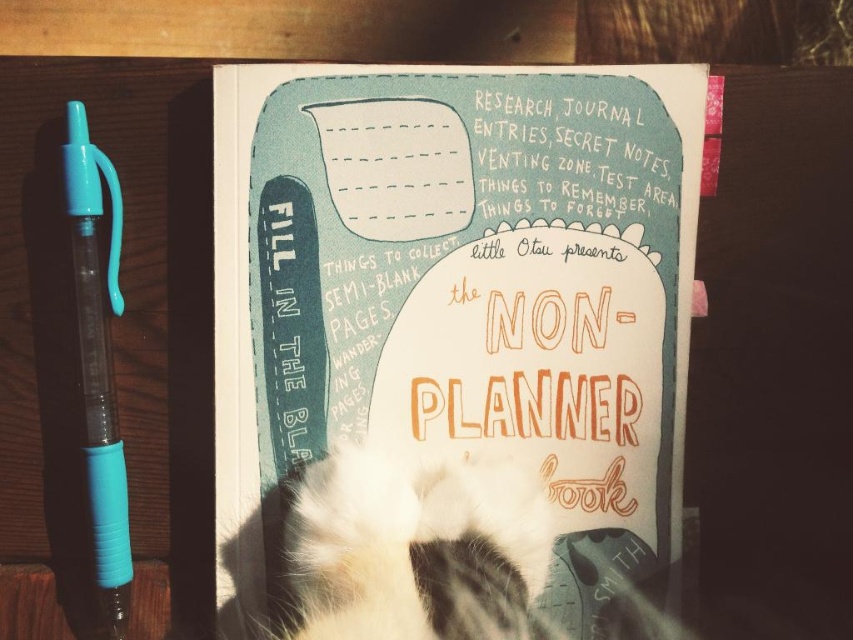
Question: Estimate the real-world distances between objects in this image. Which object is farther from the translucent blue plastic pen at left?

Choices:
 (A) fluffy white fur at center
 (B) matte paper journal at center

Answer: (B)

Question: Can you confirm if matte paper journal at center is positioned to the left of translucent blue plastic pen at left?

Choices:
 (A) yes
 (B) no

Answer: (B)

Question: Which point is farther from the camera taking this photo?

Choices:
 (A) (297, 384)
 (B) (100, 186)

Answer: (A)

Question: Which of the following is the closest to the observer?

Choices:
 (A) matte paper journal at center
 (B) translucent blue plastic pen at left

Answer: (B)

Question: Does fluffy white fur at center appear on the left side of translucent blue plastic pen at left?

Choices:
 (A) yes
 (B) no

Answer: (B)

Question: Can you confirm if matte paper journal at center is positioned above translucent blue plastic pen at left?

Choices:
 (A) yes
 (B) no

Answer: (A)